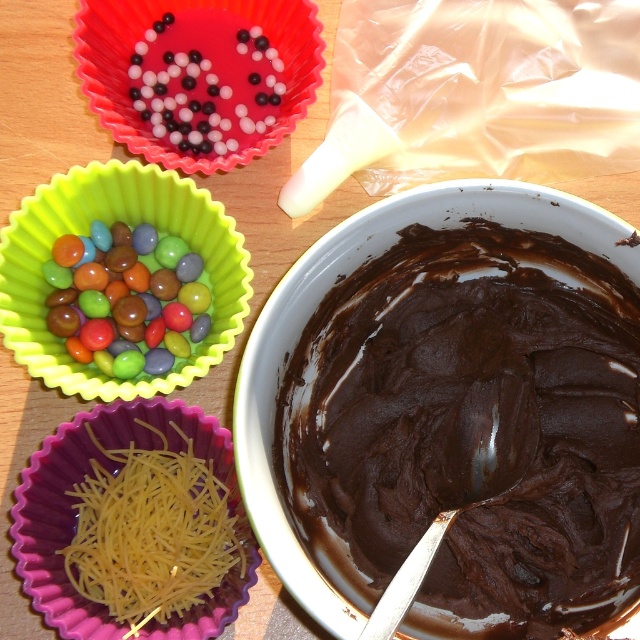
Based on the photo, is black glossy beads at upper center further to the viewer compared to shiny silver spoon at center?

Yes, it is.

Which is in front, point (195, 72) or point (464, 474)?

Point (464, 474) is in front.

Locate an element on the screen. The image size is (640, 640). black glossy beads at upper center is located at coordinates (205, 83).

Can you confirm if shiny plastic cupcake liner at upper left is positioned below yellow string cheese at lower left?

Incorrect, shiny plastic cupcake liner at upper left is not positioned below yellow string cheese at lower left.

Does point (40, 243) come in front of point (209, 529)?

No.

The width and height of the screenshot is (640, 640). In order to click on shiny plastic cupcake liner at upper left in this screenshot , I will do `click(108, 221)`.

You are a GUI agent. You are given a task and a screenshot of the screen. Output one action in this format:
    pyautogui.click(x=<x>, y=<y>)
    Task: Click on the shiny plastic cupcake liner at upper left
    
    Given the screenshot: What is the action you would take?
    pyautogui.click(x=108, y=221)

Can you confirm if dark chocolate paste at center is smaller than colorful glossy candy at upper left?

Incorrect, dark chocolate paste at center is not smaller in size than colorful glossy candy at upper left.

Does dark chocolate paste at center have a lesser width compared to colorful glossy candy at upper left?

Incorrect, dark chocolate paste at center's width is not less than colorful glossy candy at upper left's.

Image resolution: width=640 pixels, height=640 pixels. What do you see at coordinates (472, 429) in the screenshot? I see `dark chocolate paste at center` at bounding box center [472, 429].

You are a GUI agent. You are given a task and a screenshot of the screen. Output one action in this format:
    pyautogui.click(x=<x>, y=<y>)
    Task: Click on the dark chocolate paste at center
    The height and width of the screenshot is (640, 640).
    Given the screenshot: What is the action you would take?
    pyautogui.click(x=472, y=429)